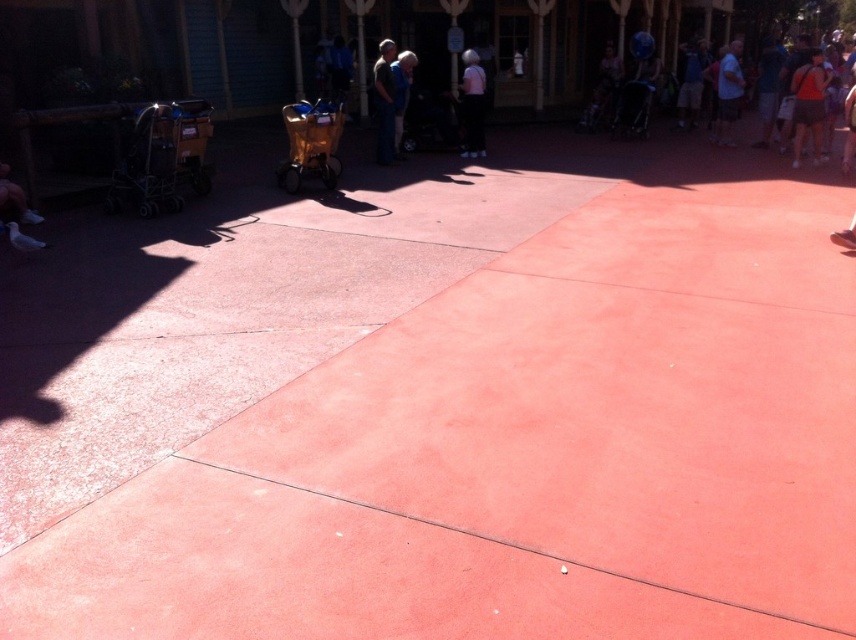
Does orange fabric bag at upper right come in front of white cotton shirt at upper right?

Yes, orange fabric bag at upper right is in front of white cotton shirt at upper right.

Can you confirm if orange fabric bag at upper right is thinner than white cotton shirt at upper right?

No, orange fabric bag at upper right is not thinner than white cotton shirt at upper right.

Does point (791, 163) come farther from viewer compared to point (726, 88)?

No.

Image resolution: width=856 pixels, height=640 pixels. I want to click on orange fabric bag at upper right, so click(807, 104).

Does gold metallic stroller at center have a smaller size compared to dark blue shirt at center?

No.

Is gold metallic stroller at center bigger than dark blue shirt at center?

Yes.

Describe the element at coordinates (311, 141) in the screenshot. I see `gold metallic stroller at center` at that location.

The width and height of the screenshot is (856, 640). I want to click on gold metallic stroller at center, so click(311, 141).

Which is behind, point (387, 108) or point (399, 152)?

The point (399, 152) is behind.

Is point (376, 140) positioned after point (402, 61)?

That is True.

Find the location of a particular element. The width and height of the screenshot is (856, 640). dark blue shirt at center is located at coordinates (384, 100).